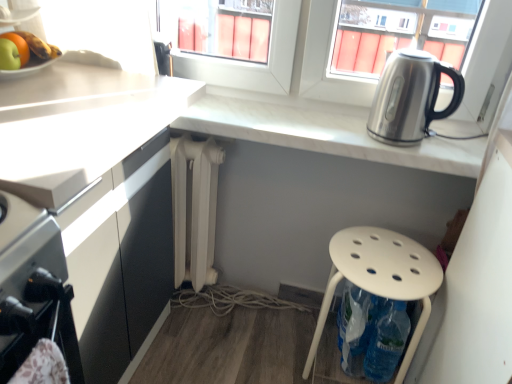
Question: Visually, is green matte apple at upper left positioned to the left or to the right of white matte radiator at center?

Choices:
 (A) left
 (B) right

Answer: (A)

Question: Considering the positions of green matte apple at upper left and white matte radiator at center in the image, is green matte apple at upper left wider or thinner than white matte radiator at center?

Choices:
 (A) wide
 (B) thin

Answer: (B)

Question: Which of these objects is positioned farthest from the shiny metallic bowl at upper left?

Choices:
 (A) white marble countertop at upper right, the 1th countertop in the right-to-left sequence
 (B) stainless steel kettle at upper right
 (C) white plastic stool at lower right
 (D) white matte radiator at center
 (E) white matte countertop at left, the 2th countertop when ordered from right to left

Answer: (C)

Question: Considering the real-world distances, which object is farthest from the stainless steel kettle at upper right?

Choices:
 (A) white matte radiator at center
 (B) white marble countertop at upper right, marked as the 2th countertop in a left-to-right arrangement
 (C) white plastic stool at lower right
 (D) white matte countertop at left, which is the 1th countertop in left-to-right order
 (E) green matte apple at upper left

Answer: (E)